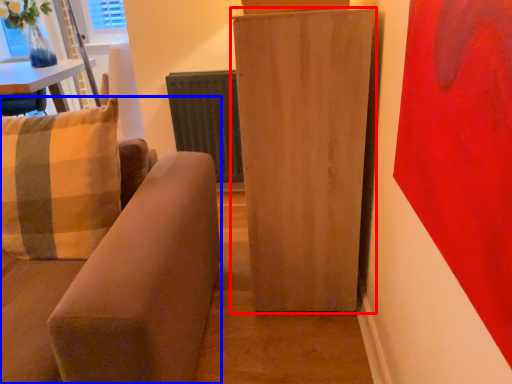
Question: Which object is closer to the camera taking this photo, furniture (highlighted by a red box) or studio couch (highlighted by a blue box)?

Choices:
 (A) furniture
 (B) studio couch

Answer: (B)